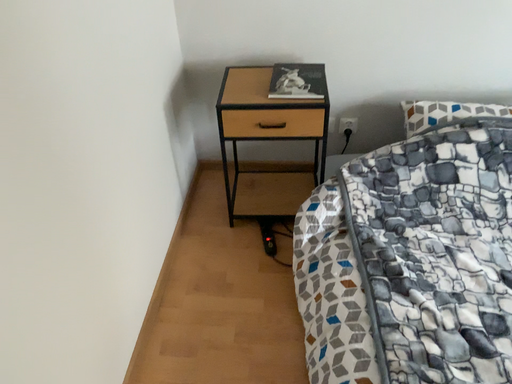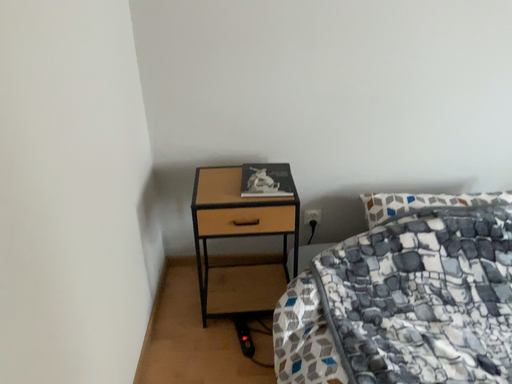
Question: Which way did the camera rotate in the video?

Choices:
 (A) rotated left
 (B) rotated right

Answer: (B)